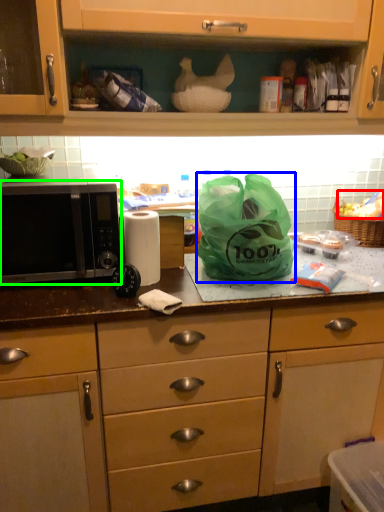
Question: Which object is the closest to the food (highlighted by a red box)? Choose among these: plastic bag (highlighted by a blue box) or microwave oven (highlighted by a green box).

Choices:
 (A) plastic bag
 (B) microwave oven

Answer: (A)